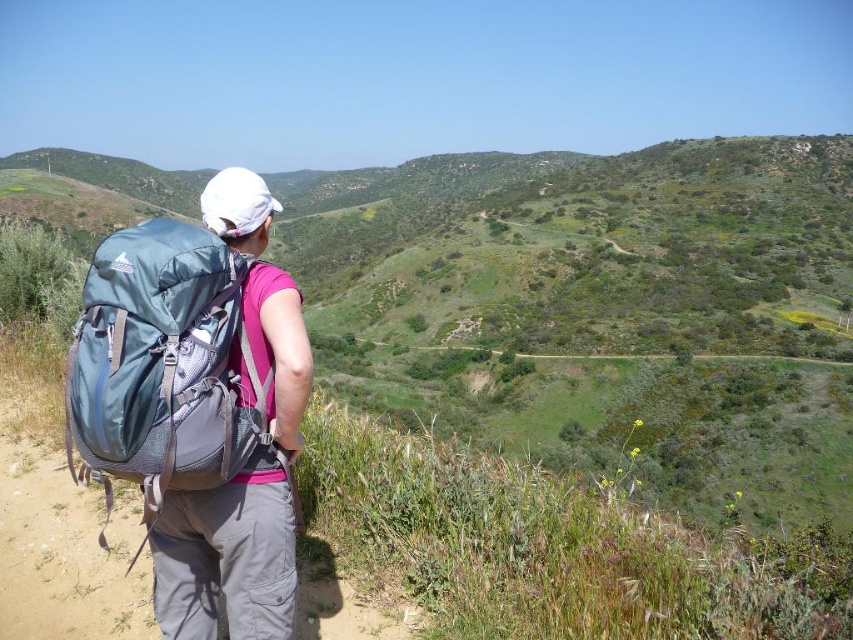
Which of these two, teal fabric backpack at left or matte blue backpack at left, stands shorter?

Standing shorter between the two is teal fabric backpack at left.

You are a GUI agent. You are given a task and a screenshot of the screen. Output one action in this format:
    pyautogui.click(x=<x>, y=<y>)
    Task: Click on the teal fabric backpack at left
    This screenshot has height=640, width=853.
    Given the screenshot: What is the action you would take?
    pyautogui.click(x=163, y=365)